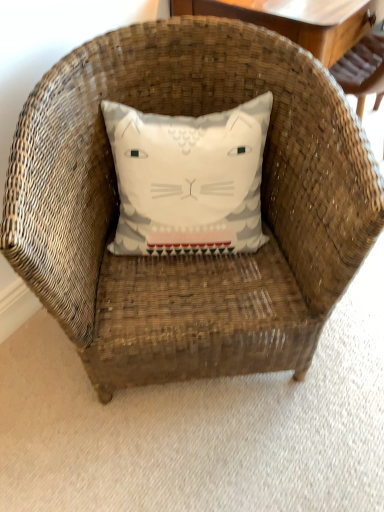
Locate an element on the screen. The image size is (384, 512). white fabric pillow at center is located at coordinates point(188,179).

The width and height of the screenshot is (384, 512). Describe the element at coordinates (188, 179) in the screenshot. I see `white fabric pillow at center` at that location.

You are a GUI agent. You are given a task and a screenshot of the screen. Output one action in this format:
    pyautogui.click(x=<x>, y=<y>)
    Task: Click on the white fabric pillow at center
    The width and height of the screenshot is (384, 512).
    Given the screenshot: What is the action you would take?
    pyautogui.click(x=188, y=179)